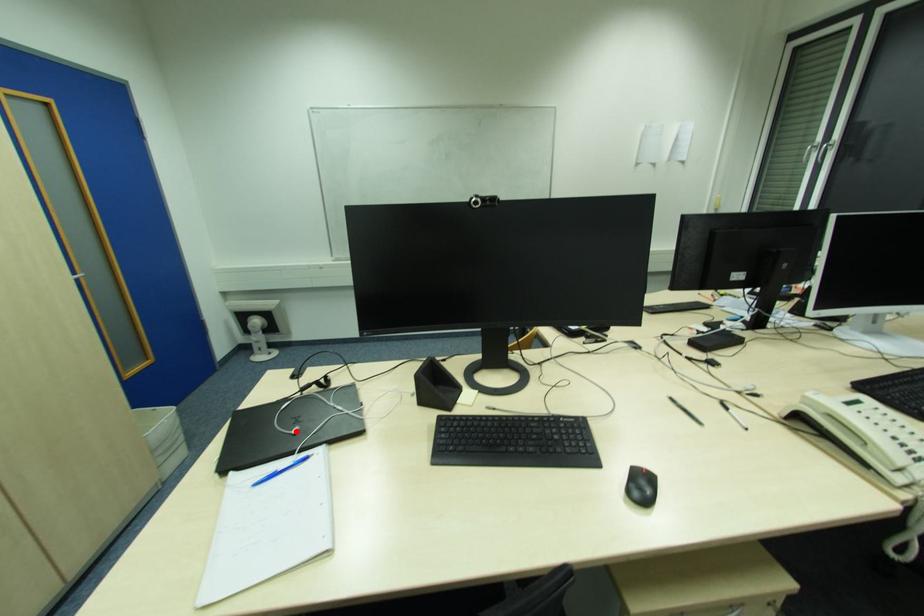
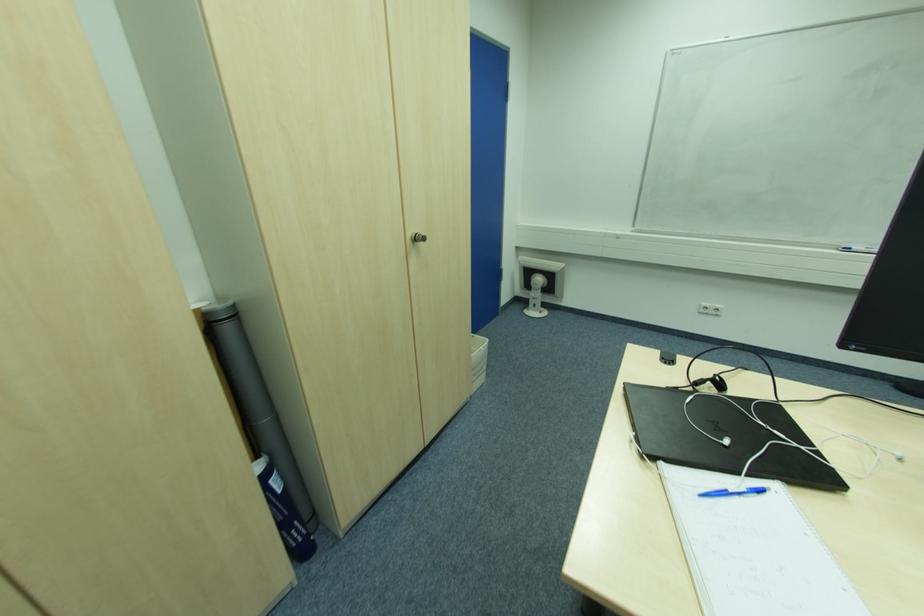
The point at the highlighted location is marked in the first image. Where is the corresponding point in the second image?

(728, 443)